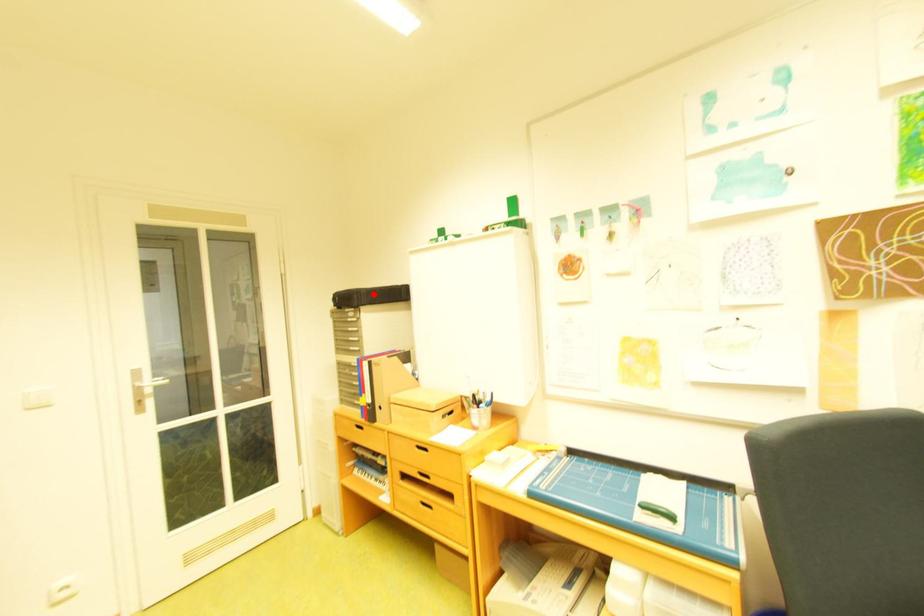
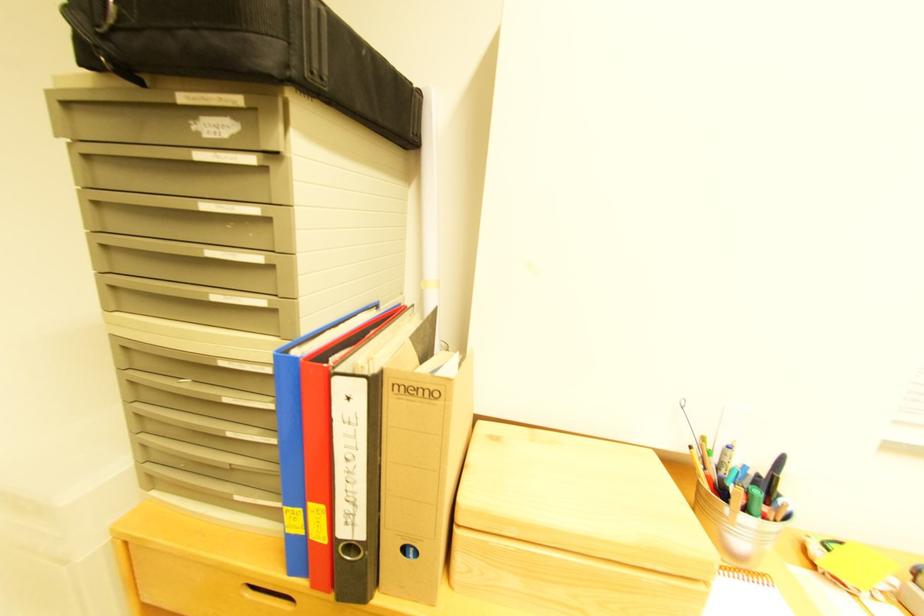
In the second image, find the point that corresponds to the highlighted location in the first image.

(330, 10)